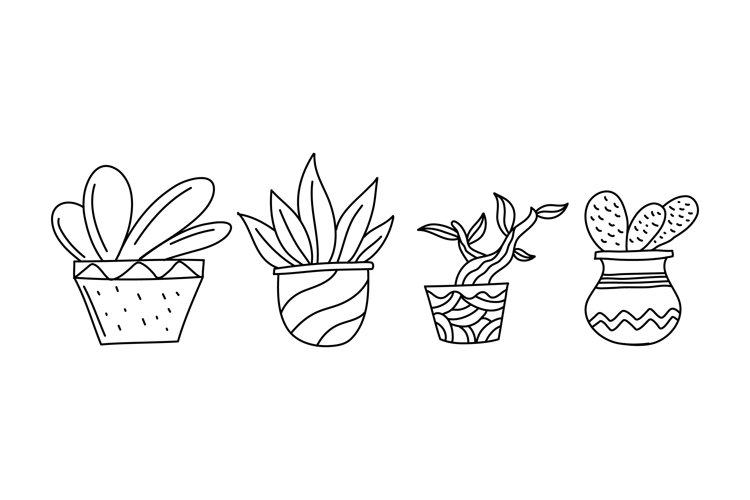
Identify the location of empty space above last  vase. (648, 151).